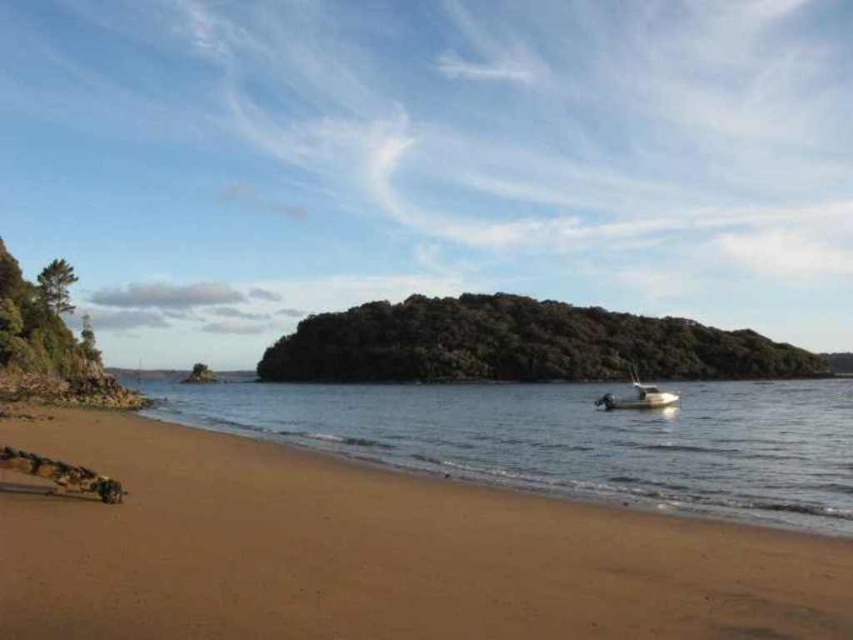
Does sandy beach at lower left appear on the right side of white plastic boat at lower right?

In fact, sandy beach at lower left is to the left of white plastic boat at lower right.

Looking at this image, who is taller, sandy beach at lower left or white plastic boat at lower right?

white plastic boat at lower right

Consider the image. Measure the distance between point (753,528) and camera.

They are 36.99 feet apart.

You are a GUI agent. You are given a task and a screenshot of the screen. Output one action in this format:
    pyautogui.click(x=<x>, y=<y>)
    Task: Click on the sandy beach at lower left
    This screenshot has height=640, width=853.
    Given the screenshot: What is the action you would take?
    pyautogui.click(x=374, y=552)

Is green leafy island at center below white plastic boat at lower right?

No.

The width and height of the screenshot is (853, 640). In order to click on green leafy island at center in this screenshot , I will do `click(518, 344)`.

Identify the location of green leafy island at center. (518, 344).

Can you confirm if sandy beach at lower left is positioned below clear water at center?

Actually, sandy beach at lower left is above clear water at center.

What do you see at coordinates (374, 552) in the screenshot? I see `sandy beach at lower left` at bounding box center [374, 552].

Who is more distant from viewer, [645,550] or [567,488]?

The point [567,488] is more distant.

I want to click on sandy beach at lower left, so pos(374,552).